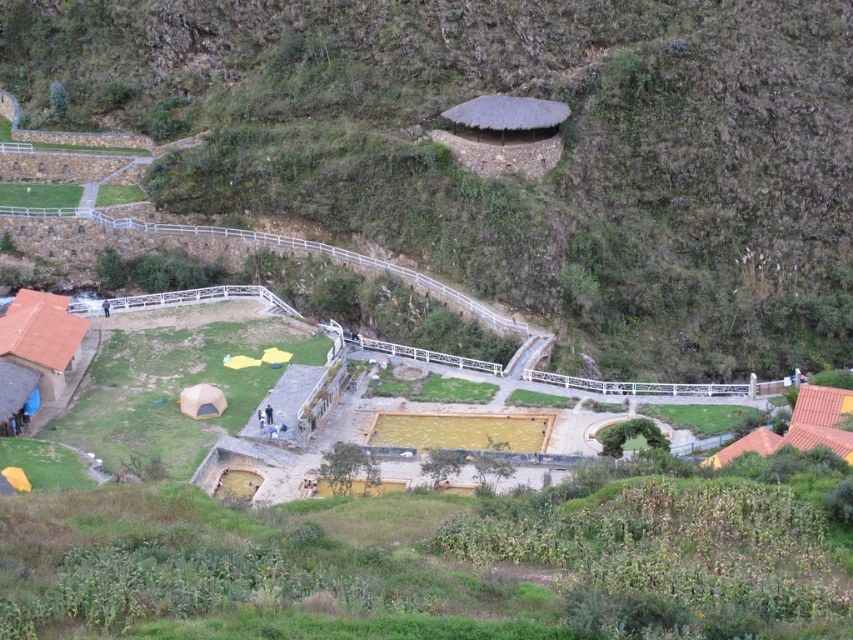
Can you confirm if thatched roof hut at upper center is smaller than matte yellow tent at lower center?

No.

In order to click on thatched roof hut at upper center in this screenshot , I will do `click(508, 113)`.

Is point (556, 100) behind point (201, 412)?

That is True.

Locate an element on the screen. This screenshot has height=640, width=853. thatched roof hut at upper center is located at coordinates (508, 113).

Locate an element on the screen. This screenshot has height=640, width=853. terracotta clay hut at lower left is located at coordinates (42, 337).

Describe the element at coordinates (42, 337) in the screenshot. The width and height of the screenshot is (853, 640). I see `terracotta clay hut at lower left` at that location.

You are a GUI agent. You are given a task and a screenshot of the screen. Output one action in this format:
    pyautogui.click(x=<x>, y=<y>)
    Task: Click on the terracotta clay hut at lower left
    
    Given the screenshot: What is the action you would take?
    pyautogui.click(x=42, y=337)

Does orange canvas tent at lower right have a smaller size compared to matte yellow tent at lower center?

No, orange canvas tent at lower right is not smaller than matte yellow tent at lower center.

Is point (761, 428) less distant than point (223, 406)?

Yes, it is.

Find the location of a particular element. Image resolution: width=853 pixels, height=640 pixels. orange canvas tent at lower right is located at coordinates (746, 445).